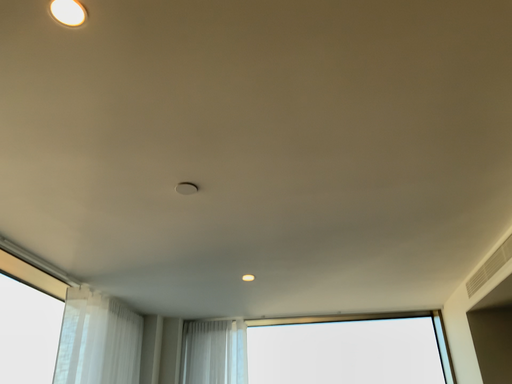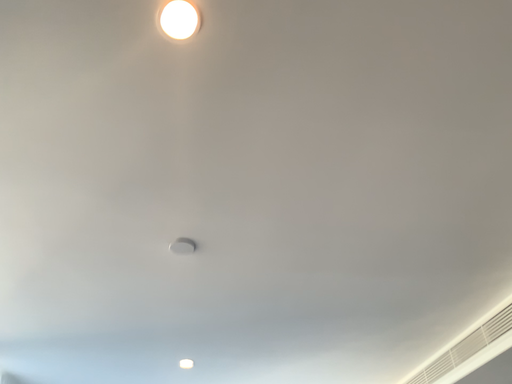
Question: Which way did the camera rotate in the video?

Choices:
 (A) rotated downward
 (B) rotated upward

Answer: (B)